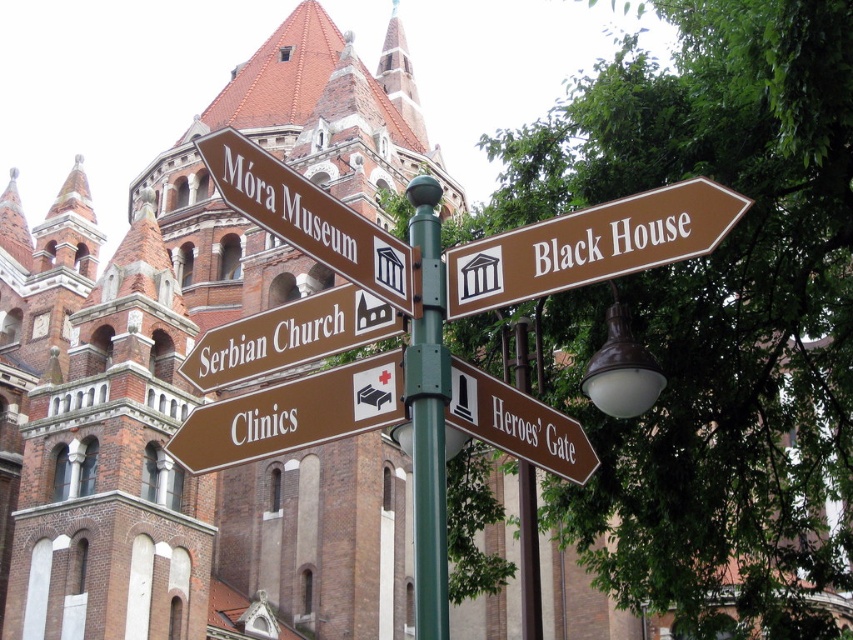
Question: Estimate the real-world distances between objects in this image. Which object is farther from the green metallic pole at center?

Choices:
 (A) brown wooden sign at center
 (B) brown matte sign at center

Answer: (A)

Question: Does brown brick church at upper center appear on the right side of brown matte sign at upper right?

Choices:
 (A) yes
 (B) no

Answer: (B)

Question: Which of the following is the closest to the observer?

Choices:
 (A) brown wooden sign at upper center
 (B) green metallic pole at center
 (C) brown matte sign at upper right

Answer: (B)

Question: Considering the relative positions of brown wooden sign at upper center and brown wooden sign at lower right in the image provided, where is brown wooden sign at upper center located with respect to brown wooden sign at lower right?

Choices:
 (A) above
 (B) below

Answer: (A)

Question: Does brown wooden sign at center have a greater width compared to brown wooden sign at lower right?

Choices:
 (A) no
 (B) yes

Answer: (B)

Question: Which of the following is the farthest from the observer?

Choices:
 (A) brown brick church at upper center
 (B) brown wooden sign at upper center

Answer: (A)